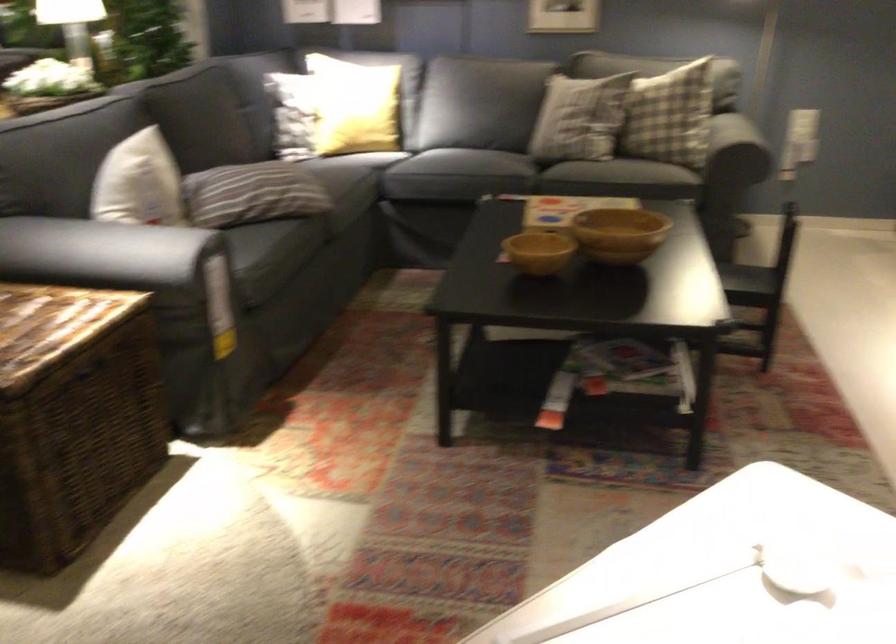
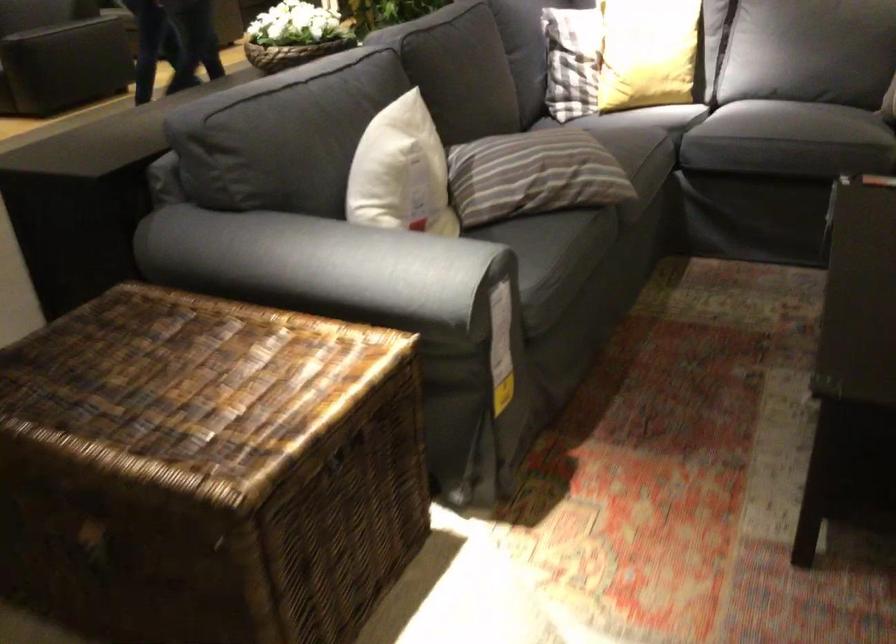
What movement of the cameraman would produce the second image?

The movement direction of the cameraman is left, forward.